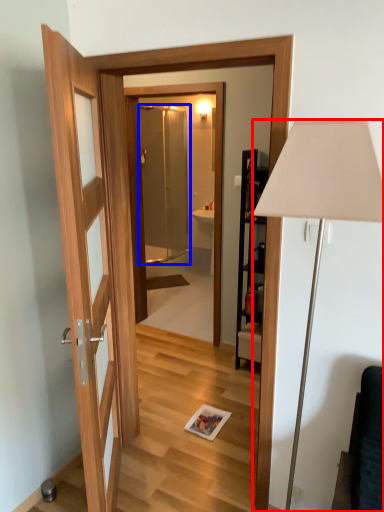
Question: Which of the following is the farthest to the observer, lamp (highlighted by a red box) or screen door (highlighted by a blue box)?

Choices:
 (A) lamp
 (B) screen door

Answer: (B)